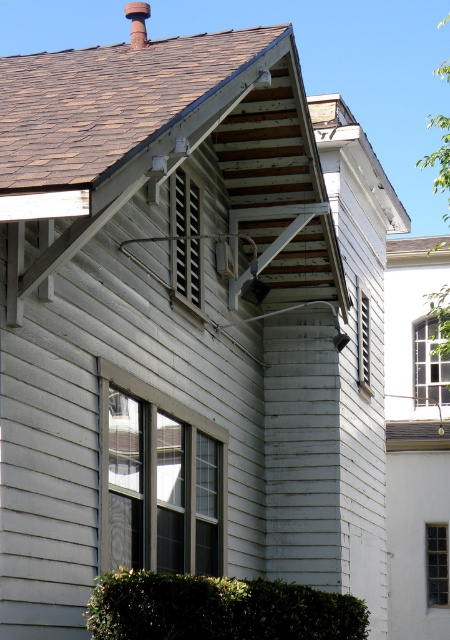
Question: Can you confirm if green leafy hedge at lower center is positioned below smooth brick chimney at upper center?

Choices:
 (A) no
 (B) yes

Answer: (B)

Question: Which of the following is the closest to the observer?

Choices:
 (A) (140, 17)
 (B) (138, 576)

Answer: (B)

Question: Can you confirm if green leafy hedge at lower center is positioned below smooth brick chimney at upper center?

Choices:
 (A) no
 (B) yes

Answer: (B)

Question: Which point appears farthest from the camera in this image?

Choices:
 (A) (297, 634)
 (B) (147, 6)

Answer: (B)

Question: Does green leafy hedge at lower center have a larger size compared to smooth brick chimney at upper center?

Choices:
 (A) yes
 (B) no

Answer: (B)